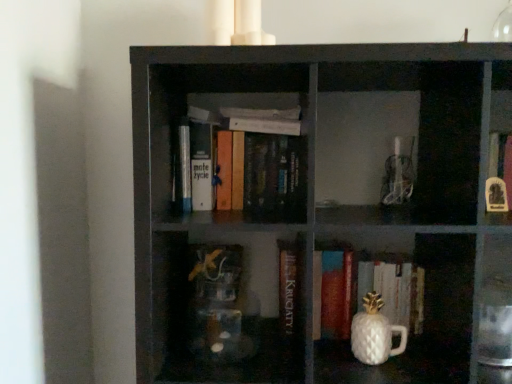
Question: Would you say hardcover books at center, the third book viewed from the right, is outside hardcover book at center, placed as the second book when sorted from right to left?

Choices:
 (A) no
 (B) yes

Answer: (B)

Question: Does hardcover books at center, which appears as the 1th book when viewed from the left, lie in front of hardcover book at center, placed as the second book when sorted from right to left?

Choices:
 (A) yes
 (B) no

Answer: (A)

Question: From the image's perspective, is hardcover books at center, which appears as the 1th book when viewed from the left, above hardcover book at center, the 2th book when ordered from left to right?

Choices:
 (A) no
 (B) yes

Answer: (B)

Question: Considering the relative sizes of hardcover books at center, the third book viewed from the right, and hardcover book at center, the 2th book when ordered from left to right, in the image provided, is hardcover books at center, the third book viewed from the right, bigger than hardcover book at center, the 2th book when ordered from left to right,?

Choices:
 (A) no
 (B) yes

Answer: (B)

Question: Can you confirm if hardcover books at center, the third book viewed from the right, is positioned to the right of hardcover book at center, the 2th book when ordered from left to right?

Choices:
 (A) no
 (B) yes

Answer: (A)

Question: Is hardcover books at center, the third book viewed from the right, taller than hardcover book at center, the 2th book when ordered from left to right?

Choices:
 (A) yes
 (B) no

Answer: (B)

Question: Does hardcover book at center, placed as the second book when sorted from right to left, have a smaller size compared to hardcover books at center, which appears as the 1th book when viewed from the left?

Choices:
 (A) yes
 (B) no

Answer: (A)

Question: Is hardcover book at center, placed as the second book when sorted from right to left, with hardcover books at center, the third book viewed from the right?

Choices:
 (A) no
 (B) yes

Answer: (A)

Question: Considering the relative sizes of hardcover book at center, placed as the second book when sorted from right to left, and hardcover books at center, the third book viewed from the right, in the image provided, is hardcover book at center, placed as the second book when sorted from right to left, shorter than hardcover books at center, the third book viewed from the right,?

Choices:
 (A) yes
 (B) no

Answer: (B)

Question: Is hardcover book at center, the 2th book when ordered from left to right, bigger than hardcover books at center, the third book viewed from the right?

Choices:
 (A) yes
 (B) no

Answer: (B)

Question: Considering the relative sizes of hardcover book at center, the 2th book when ordered from left to right, and hardcover books at center, the third book viewed from the right, in the image provided, is hardcover book at center, the 2th book when ordered from left to right, taller than hardcover books at center, the third book viewed from the right,?

Choices:
 (A) no
 (B) yes

Answer: (B)

Question: Is hardcover book at center, placed as the second book when sorted from right to left, facing away from hardcover books at center, the third book viewed from the right?

Choices:
 (A) no
 (B) yes

Answer: (A)

Question: Is black matte bookshelf at center oriented towards transparent glass vase at upper right?

Choices:
 (A) yes
 (B) no

Answer: (B)